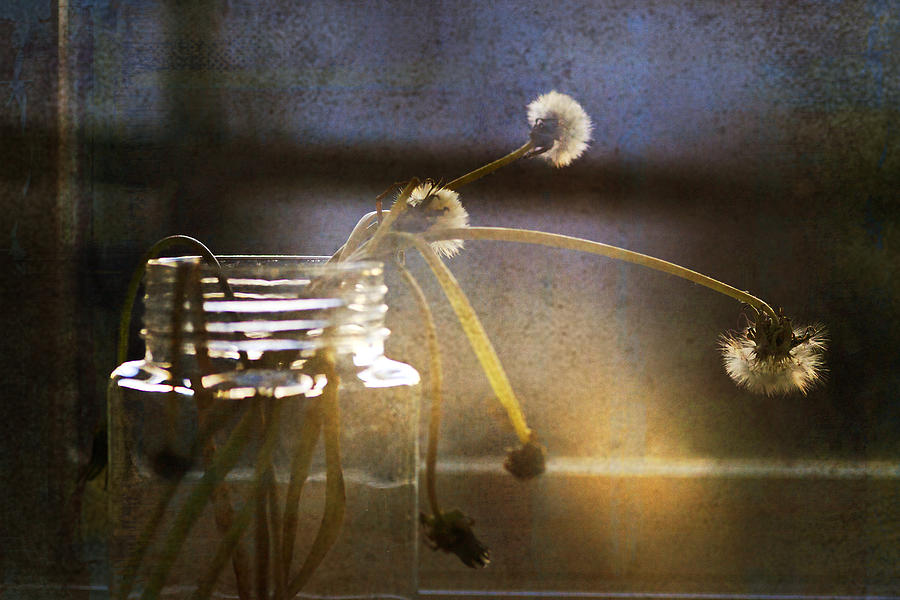
This screenshot has width=900, height=600. In order to click on jar in this screenshot , I will do `click(329, 464)`.